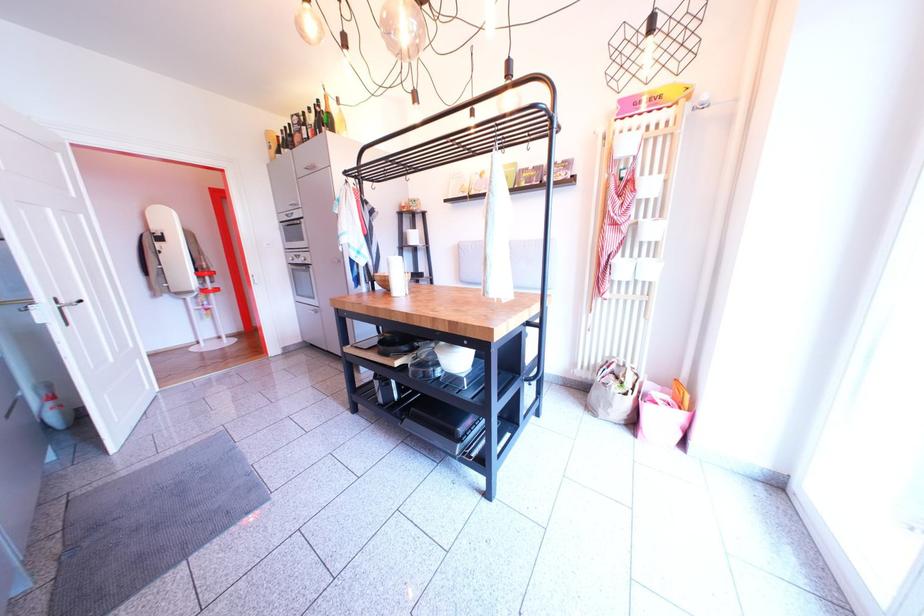
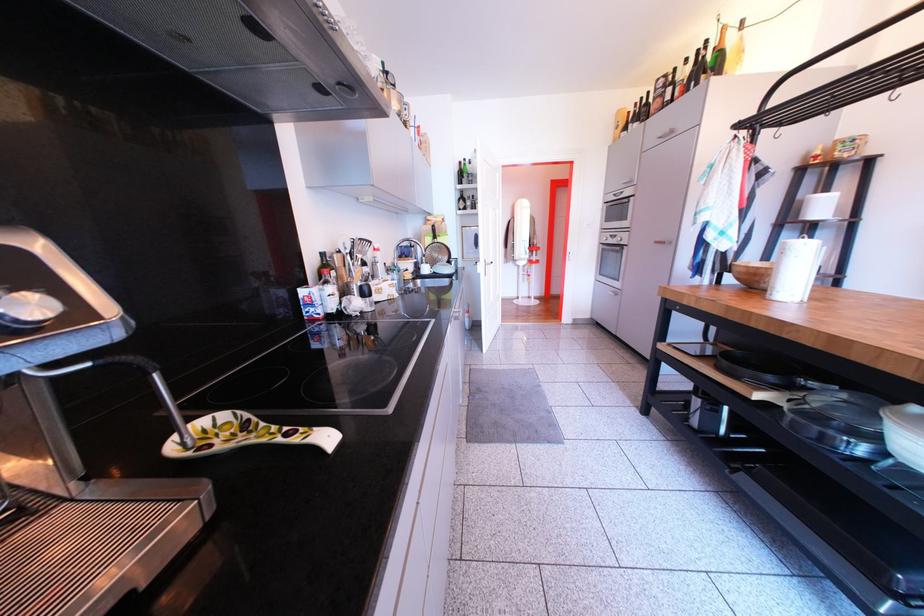
Find the pixel in the second image that matches point 314,120 in the first image.

(687, 75)